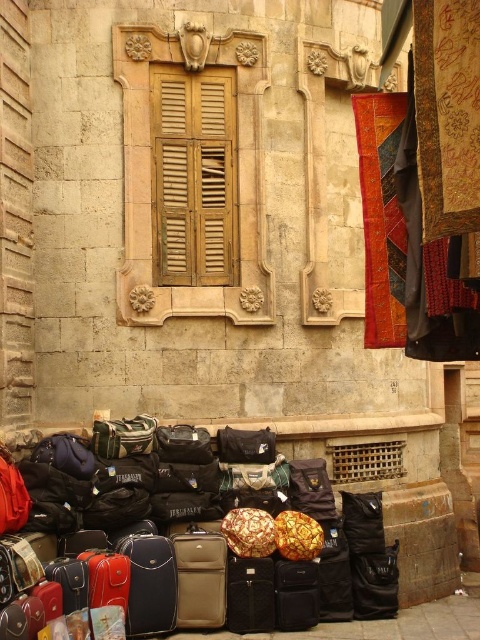
You are at an airport and need to identify your luggage. You remember that your luggage is the larger one between the matte black suitcase at lower center and the wooden at center. Which one should you choose?

The matte black suitcase at lower center is larger than the wooden at center, so you should choose the matte black suitcase at lower center.